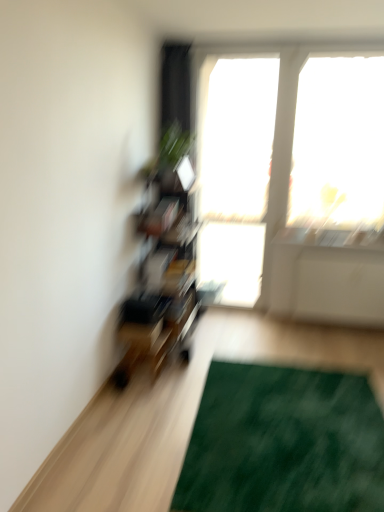
Question: Which direction should I rotate to face transparent glass window at center, the first window screen from the left, — up or down?

Choices:
 (A) down
 (B) up

Answer: (B)

Question: Does transparent glass window at center, the first window screen from the left, appear on the right side of transparent glass window at upper right, the 2th window screen in the left-to-right sequence?

Choices:
 (A) no
 (B) yes

Answer: (A)

Question: Is transparent glass window at center, the first window screen from the left, wider than transparent glass window at upper right, the 2th window screen in the left-to-right sequence?

Choices:
 (A) no
 (B) yes

Answer: (B)

Question: Does transparent glass window at center, the first window screen from the left, touch transparent glass window at upper right, which appears as the first window screen when viewed from the right?

Choices:
 (A) no
 (B) yes

Answer: (A)

Question: Does transparent glass window at center, which is counted as the second window screen, starting from the right, come behind transparent glass window at upper right, the 2th window screen in the left-to-right sequence?

Choices:
 (A) no
 (B) yes

Answer: (B)

Question: Is transparent glass window at center, which is counted as the second window screen, starting from the right, thinner than transparent glass window at upper right, the 2th window screen in the left-to-right sequence?

Choices:
 (A) yes
 (B) no

Answer: (B)

Question: Is transparent glass window at center, the first window screen from the left, closer to camera compared to transparent glass window at upper right, the 2th window screen in the left-to-right sequence?

Choices:
 (A) no
 (B) yes

Answer: (A)

Question: From the image's perspective, is green leafy plant at upper center above transparent glass window at center, which is counted as the second window screen, starting from the right?

Choices:
 (A) yes
 (B) no

Answer: (A)

Question: Considering the relative sizes of green leafy plant at upper center and transparent glass window at center, which is counted as the second window screen, starting from the right, in the image provided, is green leafy plant at upper center shorter than transparent glass window at center, which is counted as the second window screen, starting from the right,?

Choices:
 (A) yes
 (B) no

Answer: (A)

Question: Is green leafy plant at upper center outside transparent glass window at center, which is counted as the second window screen, starting from the right?

Choices:
 (A) no
 (B) yes

Answer: (B)

Question: From a real-world perspective, is green leafy plant at upper center below transparent glass window at center, which is counted as the second window screen, starting from the right?

Choices:
 (A) yes
 (B) no

Answer: (B)

Question: Is transparent glass window at center, the first window screen from the left, completely or partially inside green leafy plant at upper center?

Choices:
 (A) no
 (B) yes

Answer: (A)

Question: From the image's perspective, is green leafy plant at upper center beneath transparent glass window at center, which is counted as the second window screen, starting from the right?

Choices:
 (A) no
 (B) yes

Answer: (A)

Question: Is transparent glass window at upper right, the 2th window screen in the left-to-right sequence, outside of green textured mat at lower right?

Choices:
 (A) no
 (B) yes

Answer: (B)